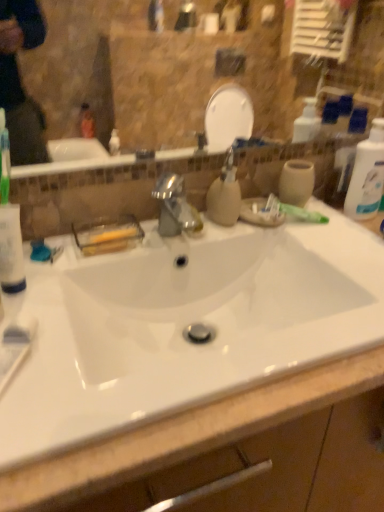
At what (x,y) coordinates should I click in order to perform the action: click on vacant space in front of green matte toothpaste at upper right. Please return your answer as a coordinate pair (x, y). This screenshot has width=384, height=512. Looking at the image, I should click on (310, 259).